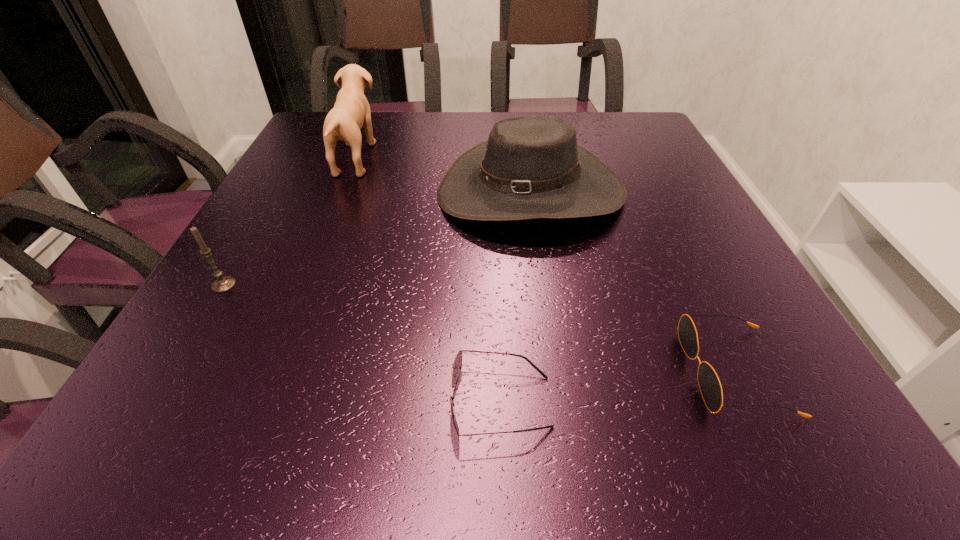
The width and height of the screenshot is (960, 540). Find the location of `free area in between the puppy and the cowboy hat`. free area in between the puppy and the cowboy hat is located at coordinates (443, 175).

I want to click on vacant point located between the left sunglasses and the fourth shortest object, so click(516, 297).

Where is `free spot between the puppy and the cowboy hat`? This screenshot has width=960, height=540. free spot between the puppy and the cowboy hat is located at coordinates (443, 175).

I want to click on vacant space in between the right sunglasses and the candle, so click(x=479, y=328).

Identify the location of vacant area between the left sunglasses and the cowboy hat. (516, 297).

Find the location of a particular element. This screenshot has height=540, width=960. unoccupied position between the second tallest object and the third nearest object is located at coordinates pyautogui.click(x=377, y=239).

This screenshot has height=540, width=960. What are the coordinates of `vacant area that lies between the second tallest object and the right sunglasses` in the screenshot? It's located at (633, 282).

You are a GUI agent. You are given a task and a screenshot of the screen. Output one action in this format:
    pyautogui.click(x=<x>, y=<y>)
    Task: Click on the vacant area between the left sunglasses and the right sunglasses
    The image size is (960, 540).
    Given the screenshot: What is the action you would take?
    pyautogui.click(x=617, y=387)

I want to click on free space that is in between the second tallest object and the third tallest object, so click(x=377, y=239).

Choose which object is the nearest neighbor to the left sunglasses. Please provide its 2D coordinates. Your answer should be formatted as a tuple, i.e. [(x, y)], where the tuple contains the x and y coordinates of a point satisfying the conditions above.

[(709, 383)]